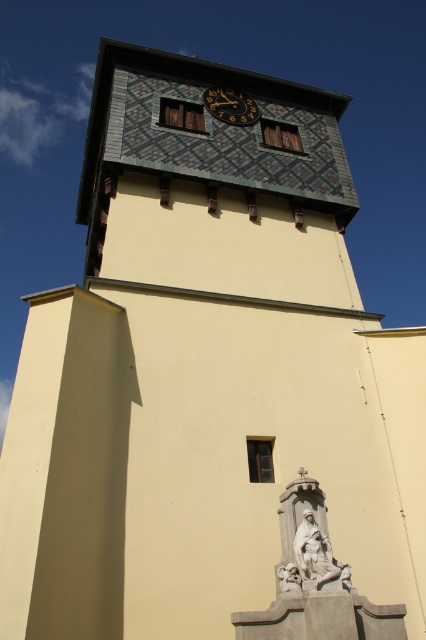
Question: Which point appears closest to the camera in this image?

Choices:
 (A) (301, 570)
 (B) (238, 102)

Answer: (A)

Question: Is the position of white marble statue at lower center more distant than that of gold metallic clock at upper center?

Choices:
 (A) yes
 (B) no

Answer: (B)

Question: Can you confirm if white marble statue at lower center is bigger than gold metallic clock at upper center?

Choices:
 (A) no
 (B) yes

Answer: (A)

Question: Can you confirm if white marble statue at lower center is wider than gold metallic clock at upper center?

Choices:
 (A) yes
 (B) no

Answer: (B)

Question: Which of the following is the farthest from the observer?

Choices:
 (A) gold metallic clock at upper center
 (B) white marble statue at lower center

Answer: (A)

Question: Among these objects, which one is nearest to the camera?

Choices:
 (A) gold metallic clock at upper center
 (B) white marble statue at lower center

Answer: (B)